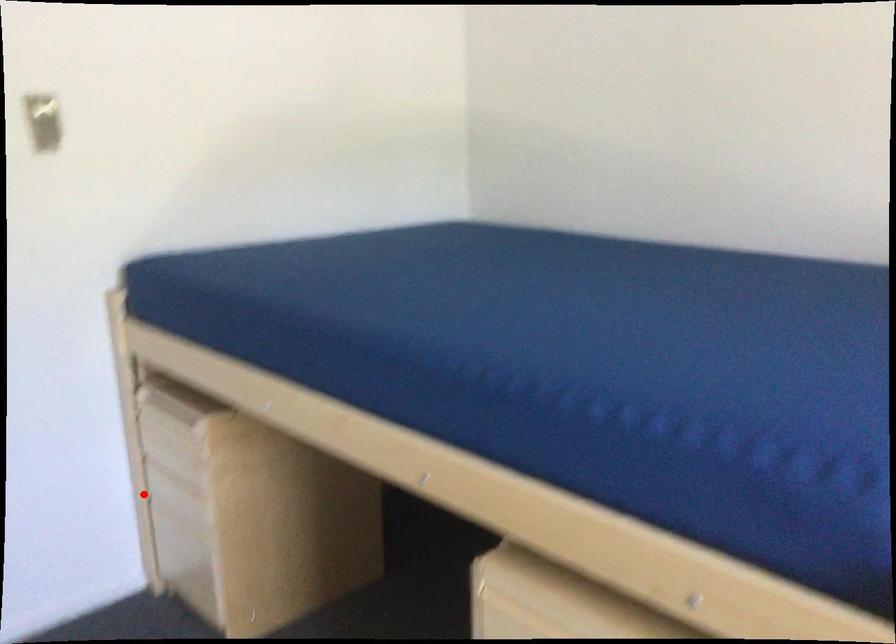
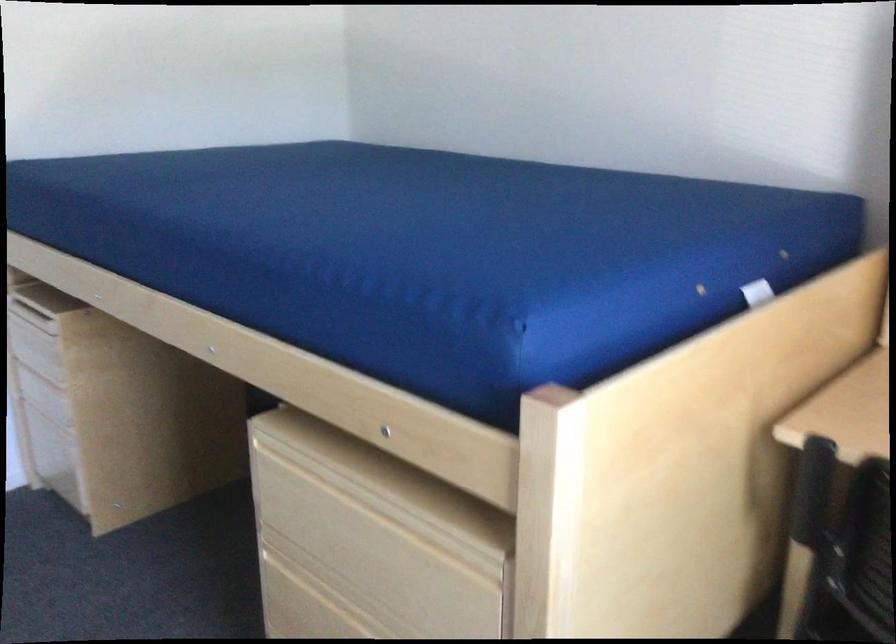
In the second image, find the point that corresponds to the highlighted location in the first image.

(19, 395)